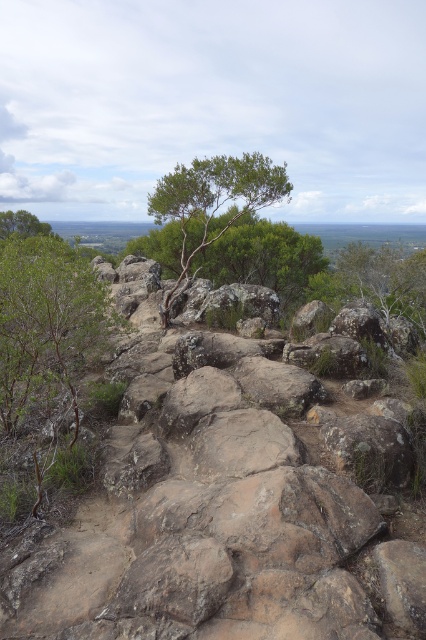
You are a hiker trying to navigate through the rocky terrain. You need to step over the rusty stone boulder at center and the green leafy tree at upper left. Which object should you avoid stepping on to prevent slipping?

You should avoid stepping on the rusty stone boulder at center because it has a smaller size compared to the green leafy tree at upper left, making it more prone to causing slips on the rocky terrain.

You are a hiker trying to navigate through the rocky terrain. You see the green leafy tree at center and the green leafy tree at upper left. Which tree would block your view of the other tree if you are standing between them?

The green leafy tree at center is in front of the green leafy tree at upper left, so if you are standing between them, the green leafy tree at center would block your view of the green leafy tree at upper left.